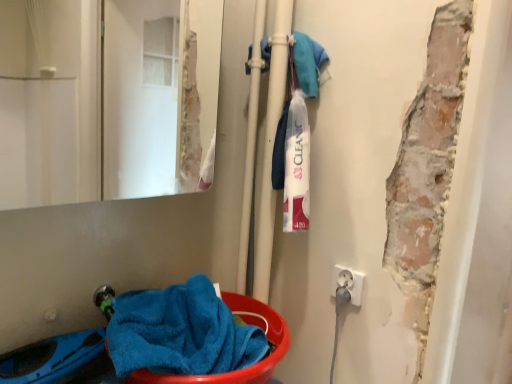
Question: From a real-world perspective, does blue soft towel at lower left sit lower than matte glass mirror at upper left?

Choices:
 (A) yes
 (B) no

Answer: (A)

Question: Is blue soft towel at lower left far away from matte glass mirror at upper left?

Choices:
 (A) yes
 (B) no

Answer: (A)

Question: Does blue soft towel at lower left lie behind matte glass mirror at upper left?

Choices:
 (A) no
 (B) yes

Answer: (B)

Question: Is blue soft towel at lower left positioned with its back to matte glass mirror at upper left?

Choices:
 (A) yes
 (B) no

Answer: (B)

Question: Considering the relative sizes of blue soft towel at lower left and matte glass mirror at upper left in the image provided, is blue soft towel at lower left shorter than matte glass mirror at upper left?

Choices:
 (A) no
 (B) yes

Answer: (B)

Question: Is blue soft towel at lower left to the right of matte glass mirror at upper left from the viewer's perspective?

Choices:
 (A) no
 (B) yes

Answer: (B)

Question: From a real-world perspective, is white plastic electrical outlet at lower right positioned under matte glass mirror at upper left based on gravity?

Choices:
 (A) no
 (B) yes

Answer: (B)

Question: Is white plastic electrical outlet at lower right surrounding matte glass mirror at upper left?

Choices:
 (A) no
 (B) yes

Answer: (A)

Question: Considering the relative sizes of white plastic electrical outlet at lower right and matte glass mirror at upper left in the image provided, is white plastic electrical outlet at lower right thinner than matte glass mirror at upper left?

Choices:
 (A) no
 (B) yes

Answer: (B)

Question: Can you confirm if white plastic electrical outlet at lower right is wider than matte glass mirror at upper left?

Choices:
 (A) yes
 (B) no

Answer: (B)

Question: Is white plastic electrical outlet at lower right at the right side of matte glass mirror at upper left?

Choices:
 (A) no
 (B) yes

Answer: (B)

Question: Does white plastic electrical outlet at lower right lie behind matte glass mirror at upper left?

Choices:
 (A) no
 (B) yes

Answer: (B)

Question: Is the surface of white plastic electrical outlet at lower right in direct contact with blue soft towel at lower left?

Choices:
 (A) no
 (B) yes

Answer: (A)